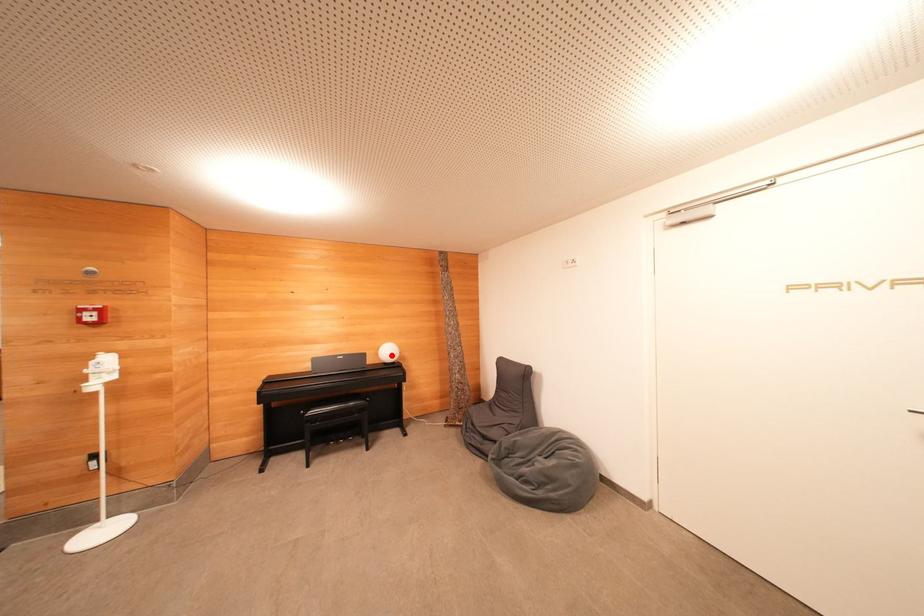
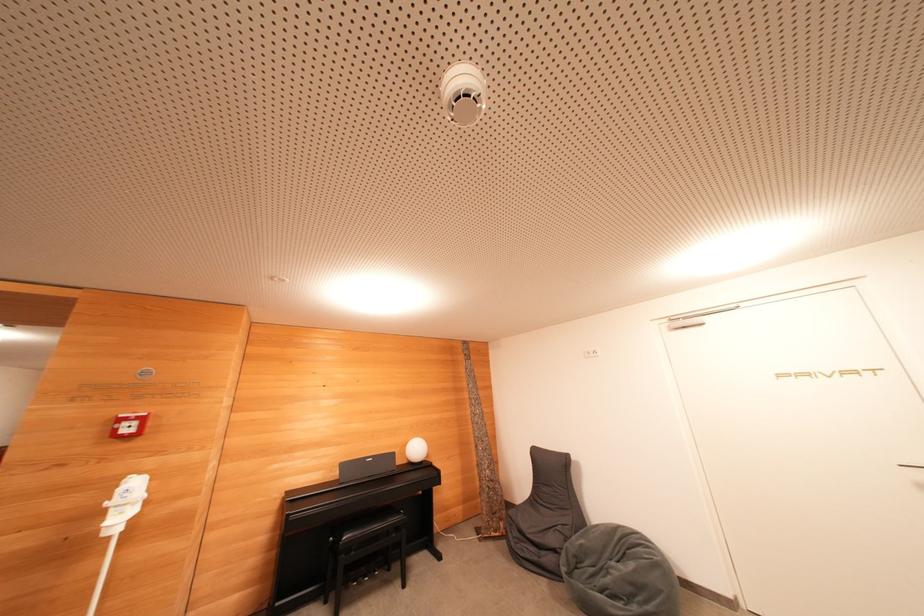
In the second image, find the point that corresponds to the highlighted location in the first image.

(419, 453)